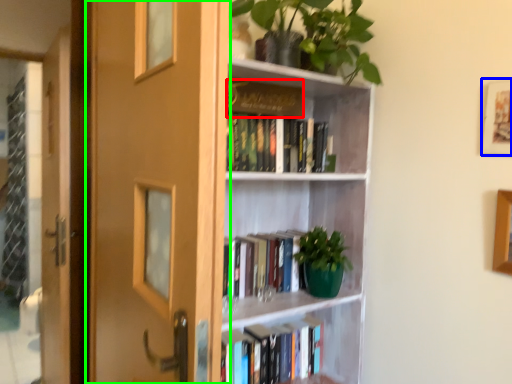
Question: Which is nearer to the book (highlighted by a red box)? picture frame (highlighted by a blue box) or door (highlighted by a green box).

Choices:
 (A) picture frame
 (B) door

Answer: (B)